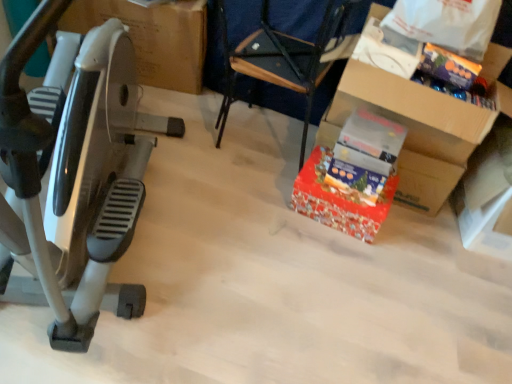
Locate an element on the screen. vacant region in front of white cardboard box at right is located at coordinates (470, 293).